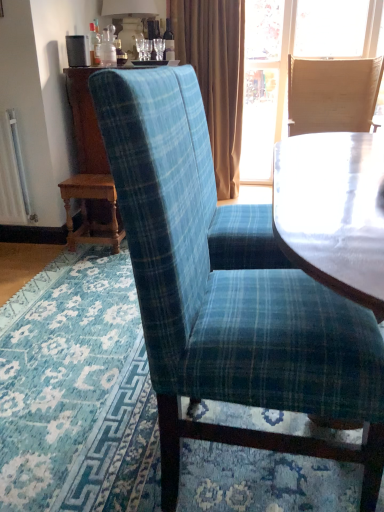
Identify the location of free space to the left of blue plaid fabric chair at center, which ranks as the first chair in left-to-right order. The image size is (384, 512). (84, 425).